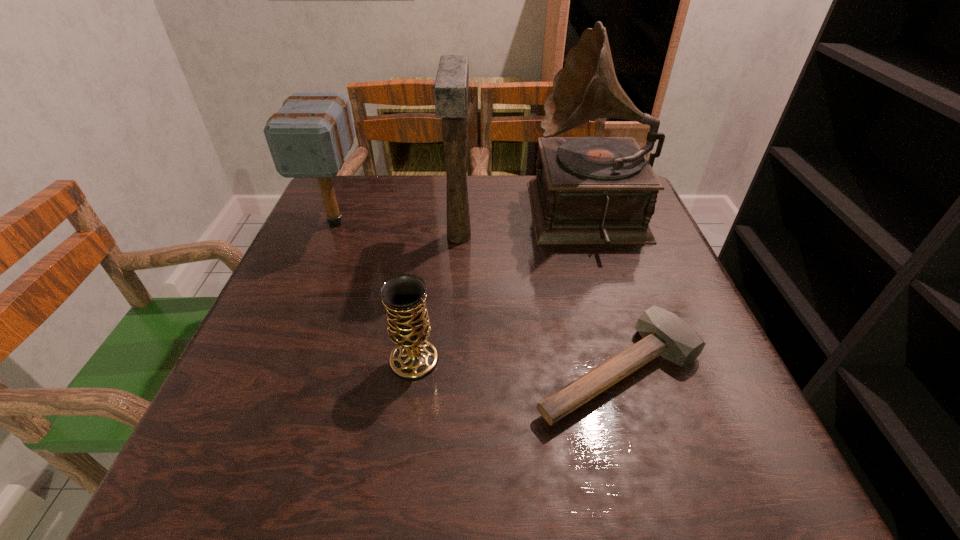
Where is `blank space that satisfies the following two spatial constraints: 1. on the striking surface of the leftmost mallet; 2. on the left side of the rightmost mallet`? This screenshot has width=960, height=540. blank space that satisfies the following two spatial constraints: 1. on the striking surface of the leftmost mallet; 2. on the left side of the rightmost mallet is located at coordinates (274, 371).